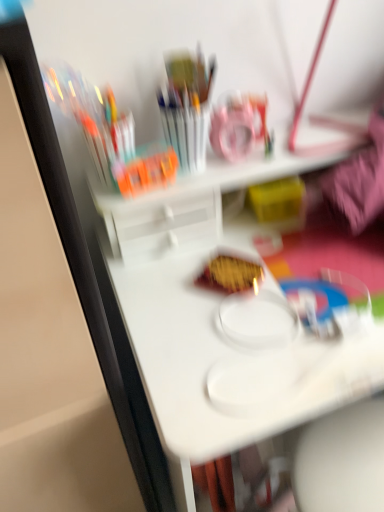
Image resolution: width=384 pixels, height=512 pixels. What do you see at coordinates (218, 360) in the screenshot?
I see `white plastic table at center` at bounding box center [218, 360].

You are a GUI agent. You are given a task and a screenshot of the screen. Output one action in this format:
    pyautogui.click(x=<x>, y=<y>)
    Task: Click on the white plastic table at center
    
    Given the screenshot: What is the action you would take?
    pyautogui.click(x=218, y=360)

You are a GUI agent. You are given a task and a screenshot of the screen. Output one action in this format:
    pyautogui.click(x=<x>, y=<y>)
    Task: Click on the yellow matte snack at center
    This screenshot has width=384, height=512.
    Given the screenshot: What is the action you would take?
    pyautogui.click(x=231, y=274)

Describe the element at coordinates (231, 274) in the screenshot. Image resolution: width=384 pixels, height=512 pixels. I see `yellow matte snack at center` at that location.

Find the location of a particular element. The image size is (384, 512). white plastic table at center is located at coordinates (218, 360).

Consider the image. Considering the relative positions of yellow matte snack at center and white plastic table at center in the image provided, is yellow matte snack at center to the left of white plastic table at center from the viewer's perspective?

Indeed, yellow matte snack at center is positioned on the left side of white plastic table at center.

Which object is closer to the camera taking this photo, yellow matte snack at center or white plastic table at center?

white plastic table at center is closer to the camera.

Is point (208, 270) closer to camera compared to point (316, 413)?

That is False.

From the image's perspective, which is above, yellow matte snack at center or white plastic table at center?

yellow matte snack at center, from the image's perspective.

From a real-world perspective, is yellow matte snack at center located higher than white plastic table at center?

Yes, from a real-world perspective, yellow matte snack at center is above white plastic table at center.

Looking at their sizes, would you say yellow matte snack at center is wider or thinner than white plastic table at center?

yellow matte snack at center is thinner than white plastic table at center.

From the picture: Can you confirm if yellow matte snack at center is shorter than white plastic table at center?

Indeed, yellow matte snack at center has a lesser height compared to white plastic table at center.

Who is bigger, yellow matte snack at center or white plastic table at center?

Bigger between the two is white plastic table at center.

Based on the photo, is yellow matte snack at center located outside white plastic table at center?

No, yellow matte snack at center is not entirely external to white plastic table at center.

Are yellow matte snack at center and white plastic table at center making contact?

yellow matte snack at center is not next to white plastic table at center, and they're not touching.

Is yellow matte snack at center facing towards white plastic table at center?

Yes, yellow matte snack at center is facing white plastic table at center.

How many degrees apart are the facing directions of yellow matte snack at center and white plastic table at center?

yellow matte snack at center and white plastic table at center are facing 49.6 degrees away from each other.

You are a GUI agent. You are given a task and a screenshot of the screen. Output one action in this format:
    pyautogui.click(x=<x>, y=<y>)
    Task: Click on the food above the white plastic table at center (from a real-world perspective)
    The height and width of the screenshot is (512, 384).
    Given the screenshot: What is the action you would take?
    pyautogui.click(x=231, y=274)

Consider the image. Which is more to the left, white plastic table at center or yellow matte snack at center?

yellow matte snack at center.

Does white plastic table at center come behind yellow matte snack at center?

No, it is in front of yellow matte snack at center.

Is point (225, 422) positioned after point (228, 291)?

No.

From the image's perspective, is white plastic table at center on top of yellow matte snack at center?

Incorrect, from the image's perspective, white plastic table at center is lower than yellow matte snack at center.

Consider the image. From a real-world perspective, is white plastic table at center physically below yellow matte snack at center?

Yes.

Consider the image. Looking at their sizes, would you say white plastic table at center is wider or thinner than yellow matte snack at center?

white plastic table at center is wider than yellow matte snack at center.

Between white plastic table at center and yellow matte snack at center, which one has more height?

white plastic table at center is taller.

Between white plastic table at center and yellow matte snack at center, which one has larger size?

white plastic table at center.

Does white plastic table at center contain yellow matte snack at center?

Yes, white plastic table at center contains yellow matte snack at center.

Are white plastic table at center and yellow matte snack at center making contact?

There is a gap between white plastic table at center and yellow matte snack at center.

Is white plastic table at center facing away from yellow matte snack at center?

Correct, white plastic table at center is looking away from yellow matte snack at center.

How many degrees apart are the facing directions of white plastic table at center and yellow matte snack at center?

The angle between the facing direction of white plastic table at center and the facing direction of yellow matte snack at center is 49.6 degrees.

Identify the location of food above the white plastic table at center (from a real-world perspective). This screenshot has height=512, width=384. (231, 274).

Find the location of a particular element. table on the right of yellow matte snack at center is located at coordinates (218, 360).

Where is `table below the yellow matte snack at center (from the image's perspective)`? The height and width of the screenshot is (512, 384). table below the yellow matte snack at center (from the image's perspective) is located at coordinates (218, 360).